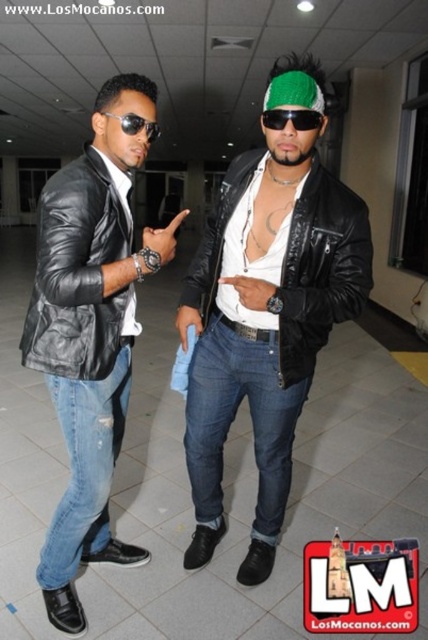
Does black leather jacket at left appear on the right side of green knitted cap at upper center?

In fact, black leather jacket at left is to the left of green knitted cap at upper center.

Is black leather jacket at left below green knitted cap at upper center?

Yes.

This screenshot has width=428, height=640. I want to click on black leather jacket at left, so click(91, 332).

Based on the photo, can you confirm if matte black leather jacket at center is thinner than matte black leather jacket at left?

In fact, matte black leather jacket at center might be wider than matte black leather jacket at left.

Who is more forward, [261,285] or [74,307]?

Positioned in front is point [261,285].

Locate an element on the screen. The image size is (428, 640). matte black leather jacket at center is located at coordinates (267, 310).

Identify the location of matte black leather jacket at center. The width and height of the screenshot is (428, 640). (267, 310).

Does matte black leather jacket at center appear on the right side of black leather jacket at left?

Indeed, matte black leather jacket at center is positioned on the right side of black leather jacket at left.

Can you confirm if matte black leather jacket at center is taller than black leather jacket at left?

Correct, matte black leather jacket at center is much taller as black leather jacket at left.

Between point (193, 472) and point (109, 316), which one is positioned behind?

Positioned behind is point (193, 472).

The width and height of the screenshot is (428, 640). I want to click on matte black leather jacket at center, so click(267, 310).